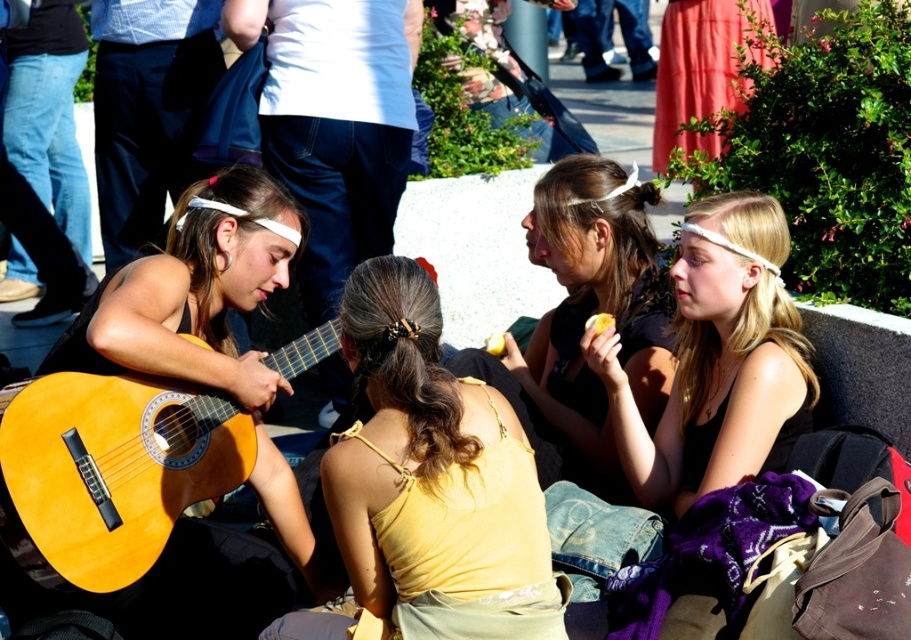
Question: Can you confirm if matte black tank top at upper right is smaller than matte black shirt at center?

Choices:
 (A) no
 (B) yes

Answer: (B)

Question: Does yellow fabric top at center have a larger size compared to matte black tank top at upper right?

Choices:
 (A) yes
 (B) no

Answer: (B)

Question: Which is farther from the yellow wood guitar at left?

Choices:
 (A) matte black tank top at upper right
 (B) matte black shirt at center
 (C) yellow fabric top at center

Answer: (A)

Question: Which object appears closest to the camera in this image?

Choices:
 (A) yellow wood guitar at left
 (B) matte black shirt at center
 (C) yellow fabric top at center
 (D) matte black tank top at upper right

Answer: (C)

Question: Which point is farther to the camera?

Choices:
 (A) yellow wood guitar at left
 (B) matte black shirt at center

Answer: (B)

Question: Can you confirm if yellow fabric top at center is bigger than yellow wood guitar at left?

Choices:
 (A) yes
 (B) no

Answer: (A)